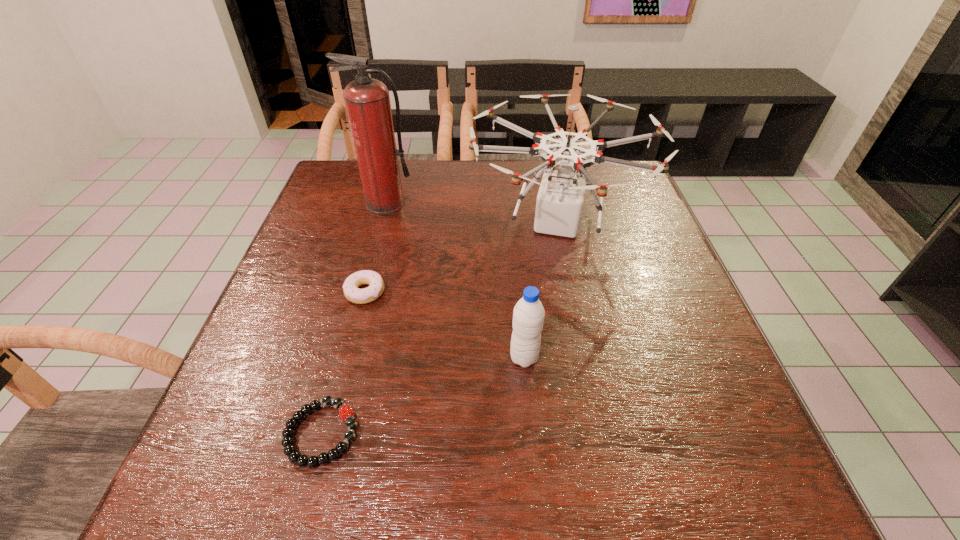
Identify the location of object located in the near left corner section of the desktop. (346, 413).

The image size is (960, 540). I want to click on object that is at the far right corner, so click(x=560, y=198).

The width and height of the screenshot is (960, 540). I want to click on vacant space at the far edge of the desktop, so click(x=510, y=159).

The height and width of the screenshot is (540, 960). In order to click on free space at the left edge of the desktop in this screenshot , I will do `click(349, 270)`.

You are a GUI agent. You are given a task and a screenshot of the screen. Output one action in this format:
    pyautogui.click(x=<x>, y=<y>)
    Task: Click on the free space at the right edge
    The width and height of the screenshot is (960, 540).
    Given the screenshot: What is the action you would take?
    pyautogui.click(x=678, y=298)

This screenshot has height=540, width=960. Identify the location of vacant region at the far right corner of the desktop. (617, 195).

Locate an element on the screen. vacant area between the drone and the second shortest object is located at coordinates (461, 257).

Find the location of a particular element. The image size is (960, 540). vacant area that lies between the third tallest object and the fire extinguisher is located at coordinates (455, 281).

Identify the location of empty space that is in between the drone and the tallest object. This screenshot has height=540, width=960. (471, 213).

Locate an element on the screen. The width and height of the screenshot is (960, 540). free spot between the second nearest object and the fire extinguisher is located at coordinates (455, 281).